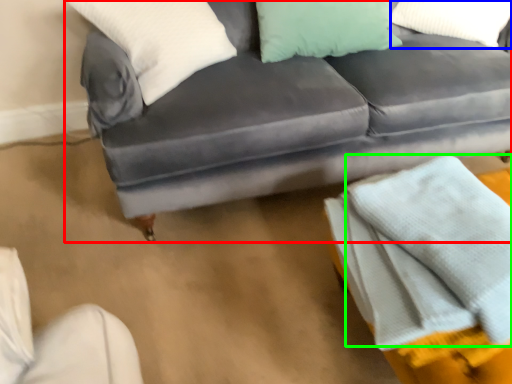
Question: Which is farther away from studio couch (highlighted by a red box)? pillow (highlighted by a blue box) or blanket (highlighted by a green box)?

Choices:
 (A) pillow
 (B) blanket

Answer: (B)